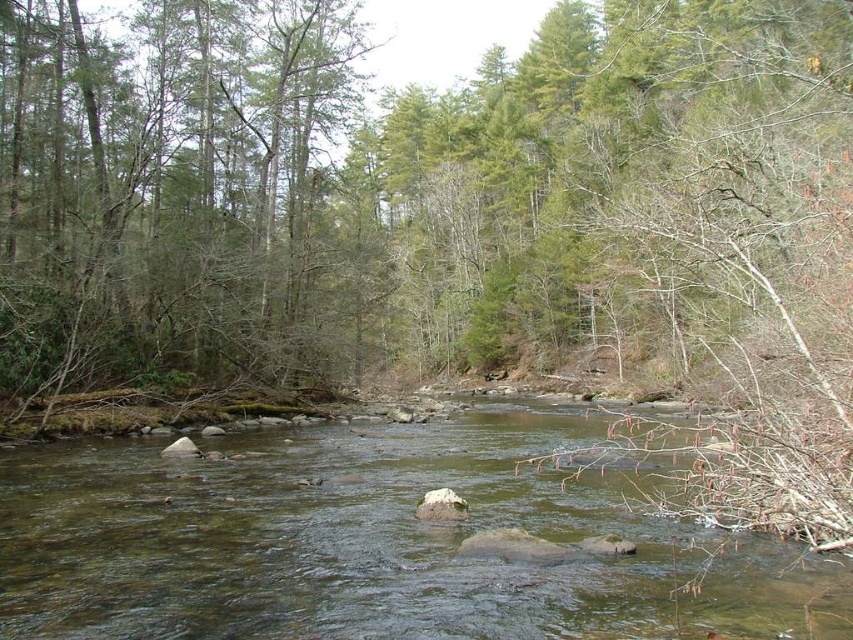
Identify the location of green mossy rocks at center. (369, 544).

Can you confirm if green mossy rocks at center is positioned to the right of bare branches at right?

No, green mossy rocks at center is not to the right of bare branches at right.

Which is in front, point (784, 570) or point (790, 296)?

Point (784, 570)

You are a GUI agent. You are given a task and a screenshot of the screen. Output one action in this format:
    pyautogui.click(x=<x>, y=<y>)
    Task: Click on the green mossy rocks at center
    
    Given the screenshot: What is the action you would take?
    pyautogui.click(x=369, y=544)